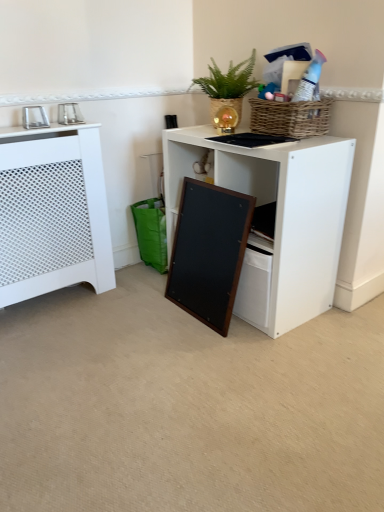
You are a GUI agent. You are given a task and a screenshot of the screen. Output one action in this format:
    pyautogui.click(x=<x>, y=<y>)
    Task: Click on the empty space that is to the right of white perforated radiator at left
    This screenshot has height=512, width=384.
    Given the screenshot: What is the action you would take?
    pyautogui.click(x=126, y=305)